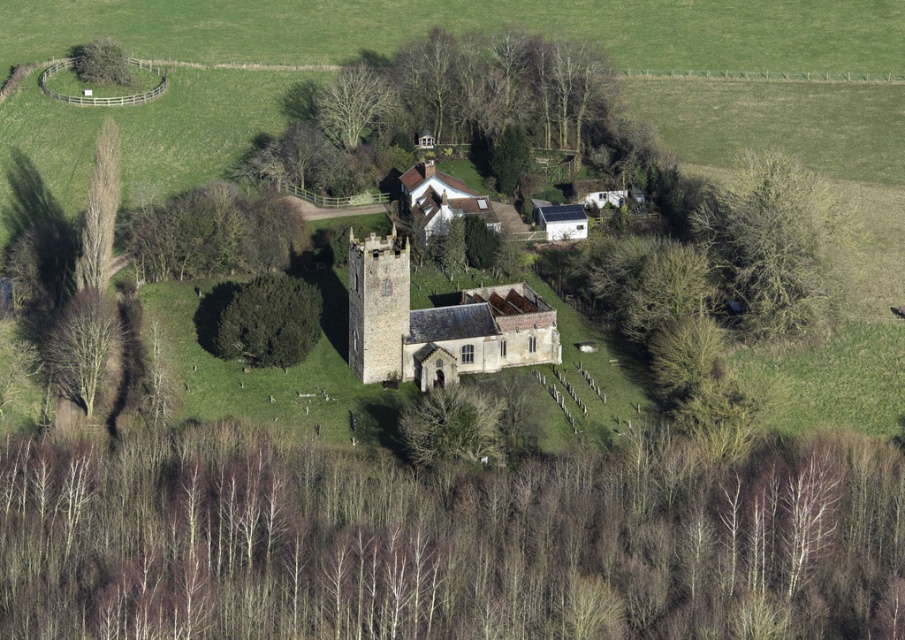
You are a landscape architect planning to add a new pathway between the green leafy bush at left and the green leafy tree at upper left. Based on their sizes, which one should you place closer to the church to ensure the pathway is wide enough for two people to walk side by side?

The green leafy bush at left is larger than the green leafy tree at upper left, so placing the bush closer to the church would leave more space between the tree and the church for the pathway, ensuring it is wide enough for two people to walk side by side.

You are a drone operator flying over a rural church. Your drone is currently above the churchyard. You notice two points marked on your map as point coordinates. Which point is closer to your drone? The points are point (283, 328) and point (103, 355).

Point (283, 328) is further to the camera than point (103, 355), so the closer point to your drone would be point (103, 355).

You are standing at the entrance of the church and want to find the green leafy bush at center. Which direction should you walk to reach it?

The green leafy bush at center is located at point (270, 321), so you should walk towards the center of the churchyard to reach it.